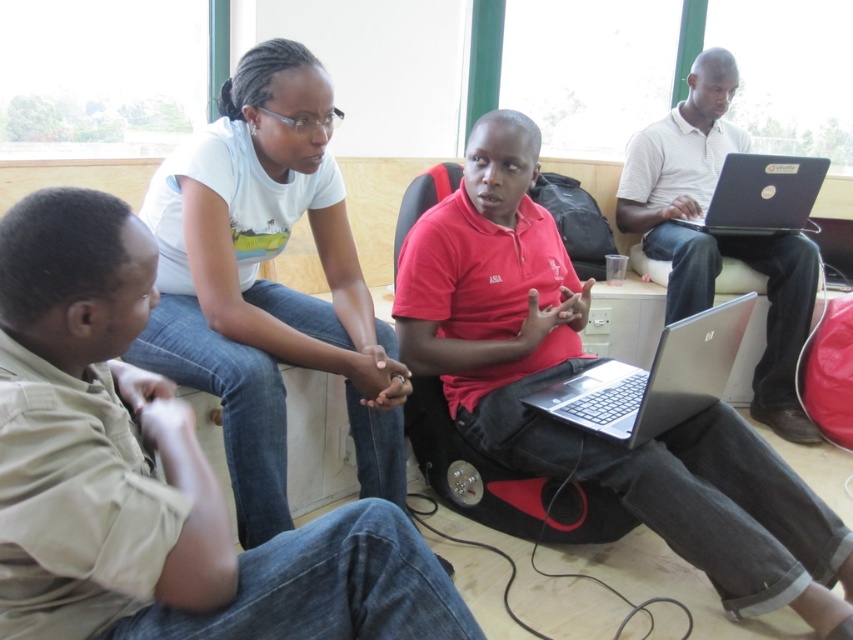
Question: Is khaki cotton shirt at lower left above white striped polo shirt at upper right?

Choices:
 (A) yes
 (B) no

Answer: (B)

Question: From the image, what is the correct spatial relationship of matte red shirt at center in relation to white cotton shirt at upper center?

Choices:
 (A) left
 (B) right

Answer: (B)

Question: Among these points, which one is farthest from the camera?

Choices:
 (A) (751, 193)
 (B) (675, 385)
 (C) (695, 524)

Answer: (A)

Question: Considering the real-world distances, which object is farthest from the white striped polo shirt at upper right?

Choices:
 (A) white cotton shirt at upper center
 (B) silver metallic laptop at center
 (C) matte red shirt at center

Answer: (A)

Question: Estimate the real-world distances between objects in this image. Which object is farther from the silver metallic laptop at center?

Choices:
 (A) black glossy laptop at upper right
 (B) white cotton shirt at upper center
 (C) white striped polo shirt at upper right
 (D) khaki cotton shirt at lower left

Answer: (A)

Question: Can you confirm if khaki cotton shirt at lower left is smaller than black glossy laptop at upper right?

Choices:
 (A) no
 (B) yes

Answer: (A)